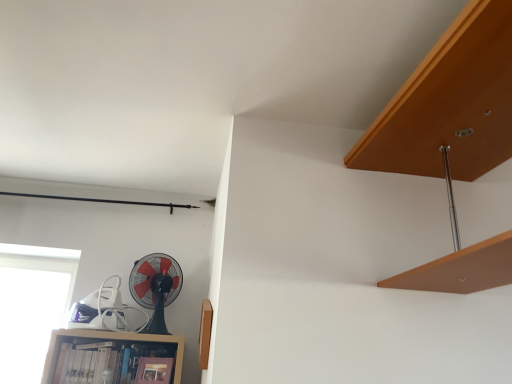
Question: From the image's perspective, is wooden bookshelf at lower left above transparent glass window at lower left?

Choices:
 (A) yes
 (B) no

Answer: (B)

Question: Is wooden bookshelf at lower left with transparent glass window at lower left?

Choices:
 (A) yes
 (B) no

Answer: (B)

Question: Considering the relative positions of wooden bookshelf at lower left and transparent glass window at lower left in the image provided, is wooden bookshelf at lower left to the left of transparent glass window at lower left from the viewer's perspective?

Choices:
 (A) no
 (B) yes

Answer: (A)

Question: From a real-world perspective, is wooden bookshelf at lower left beneath transparent glass window at lower left?

Choices:
 (A) no
 (B) yes

Answer: (B)

Question: Is wooden bookshelf at lower left not within transparent glass window at lower left?

Choices:
 (A) yes
 (B) no

Answer: (A)

Question: From a real-world perspective, is transparent glass window at lower left above or below wooden bookshelf at lower left?

Choices:
 (A) below
 (B) above

Answer: (B)

Question: From the image's perspective, is transparent glass window at lower left located above or below wooden bookshelf at lower left?

Choices:
 (A) above
 (B) below

Answer: (A)

Question: Is point (45, 248) positioned closer to the camera than point (69, 332)?

Choices:
 (A) closer
 (B) farther

Answer: (B)

Question: In terms of size, does transparent glass window at lower left appear bigger or smaller than wooden bookshelf at lower left?

Choices:
 (A) small
 (B) big

Answer: (B)

Question: In terms of width, does transparent glass window at lower left look wider or thinner when compared to black plastic fan at lower left?

Choices:
 (A) thin
 (B) wide

Answer: (A)

Question: Is transparent glass window at lower left to the left or to the right of black plastic fan at lower left in the image?

Choices:
 (A) left
 (B) right

Answer: (A)

Question: Is transparent glass window at lower left taller or shorter than black plastic fan at lower left?

Choices:
 (A) short
 (B) tall

Answer: (B)

Question: Is transparent glass window at lower left in front of or behind black plastic fan at lower left in the image?

Choices:
 (A) behind
 (B) front

Answer: (A)

Question: Considering their positions, is wooden bookshelf at lower left located in front of or behind transparent glass window at lower left?

Choices:
 (A) front
 (B) behind

Answer: (A)

Question: Considering the relative positions of wooden bookshelf at lower left and transparent glass window at lower left in the image provided, is wooden bookshelf at lower left to the left or to the right of transparent glass window at lower left?

Choices:
 (A) right
 (B) left

Answer: (A)